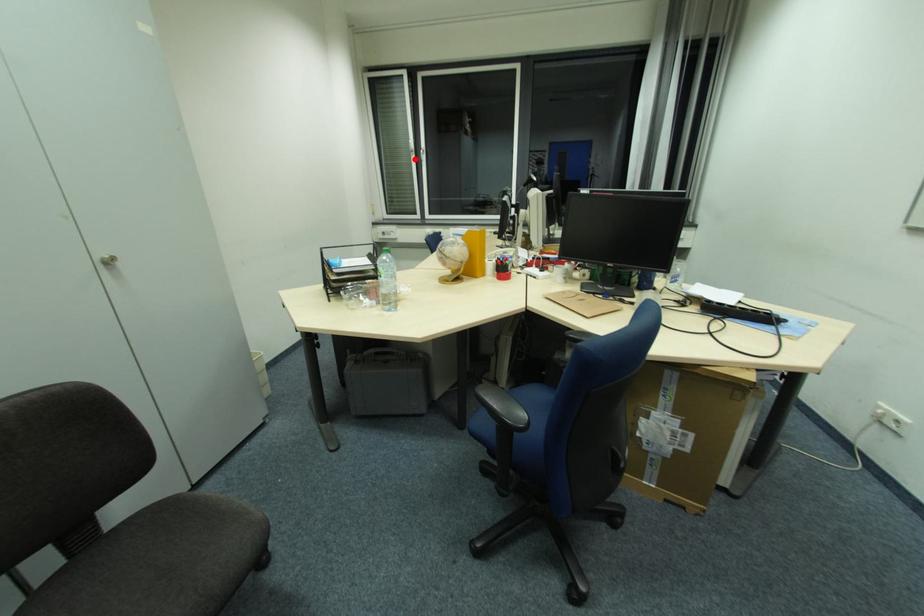
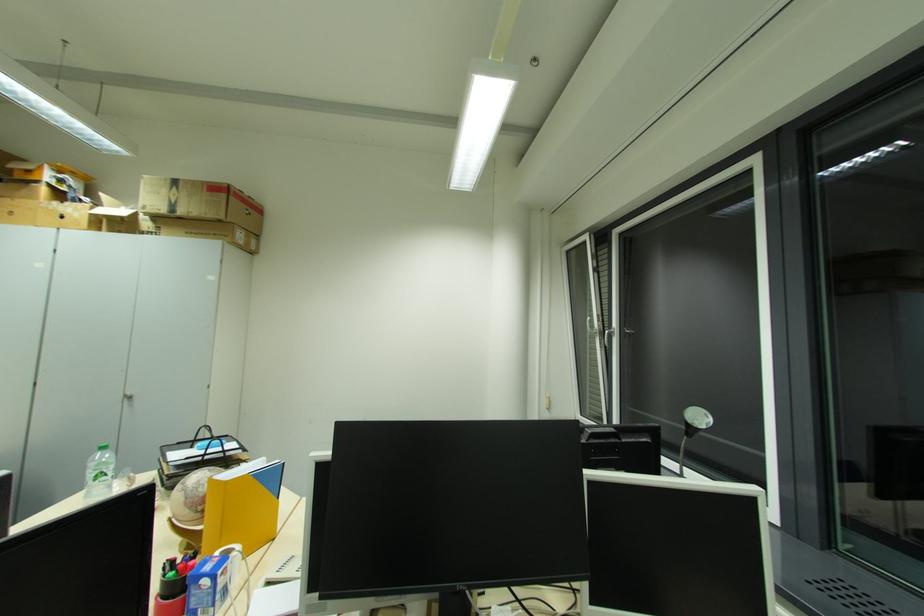
Question: I am providing you with two images of the same scene from different viewpoints. Image1 has a red point marked. In image2, the corresponding 3D location appears at what relative position? Reply with the corresponding letter.

Choices:
 (A) Closer
 (B) Farther

Answer: (B)